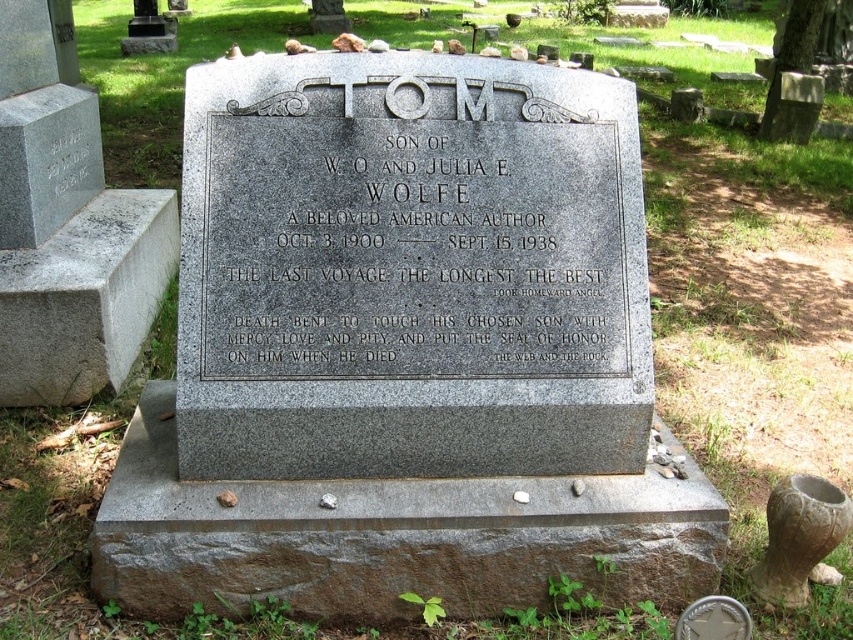
Between gray granite plaque at center and brushed metal urn at upper left, which one is positioned higher?

brushed metal urn at upper left

Between gray granite plaque at center and brushed metal urn at upper left, which one appears on the right side from the viewer's perspective?

gray granite plaque at center is more to the right.

Which is behind, point (306, 102) or point (152, 36)?

Point (152, 36)

Identify the location of gray granite plaque at center. (410, 269).

Does black granite plaque at center appear over brushed metal urn at upper left?

No.

Between point (596, 168) and point (160, 35), which one is positioned in front?

Point (596, 168) is in front.

This screenshot has height=640, width=853. Identify the location of black granite plaque at center. (410, 250).

Who is positioned more to the right, black granite plaque at center or granite gravestone at center?

black granite plaque at center is more to the right.

At what (x,y) coordinates should I click in order to perform the action: click on black granite plaque at center. Please return your answer as a coordinate pair (x, y). The image size is (853, 640). Looking at the image, I should click on pos(410,250).

Which is in front, point (233, 134) or point (61, 74)?

Point (233, 134)

Find the location of a particular element. black granite plaque at center is located at coordinates (410, 250).